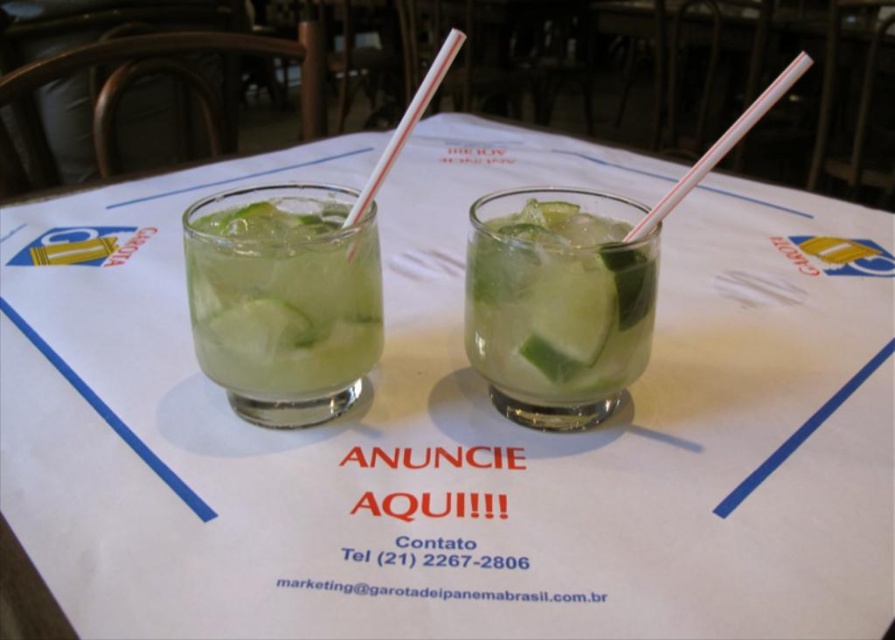
Question: Can you confirm if green translucent glass at center is thinner than translucent glass drink at left?

Choices:
 (A) yes
 (B) no

Answer: (A)

Question: Which of the following is the farthest from the observer?

Choices:
 (A) (296, 358)
 (B) (441, 51)

Answer: (A)

Question: Observing the image, what is the correct spatial positioning of translucent glass drink at left in reference to white striped plastic straw at center?

Choices:
 (A) right
 (B) left

Answer: (B)

Question: Does translucent glass drink at left appear on the right side of white striped plastic straw at center?

Choices:
 (A) yes
 (B) no

Answer: (B)

Question: Based on their relative distances, which object is nearer to the white striped plastic straw at center?

Choices:
 (A) green translucent glass at center
 (B) translucent glass drink at left

Answer: (B)

Question: Which point is farther to the camera?

Choices:
 (A) translucent glass drink at left
 (B) white striped plastic straw at center
 (C) green translucent glass at center

Answer: (C)